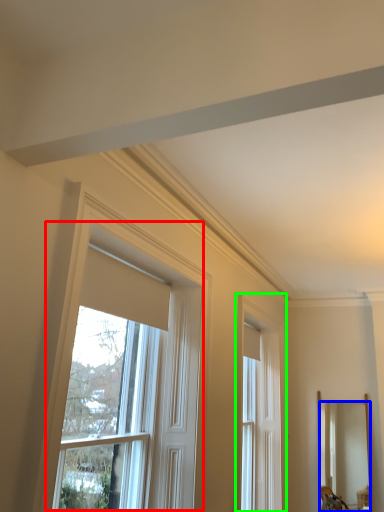
Question: Based on their relative distances, which object is farther from window (highlighted by a red box)? Choose from mirror (highlighted by a blue box) and window (highlighted by a green box).

Choices:
 (A) mirror
 (B) window

Answer: (A)